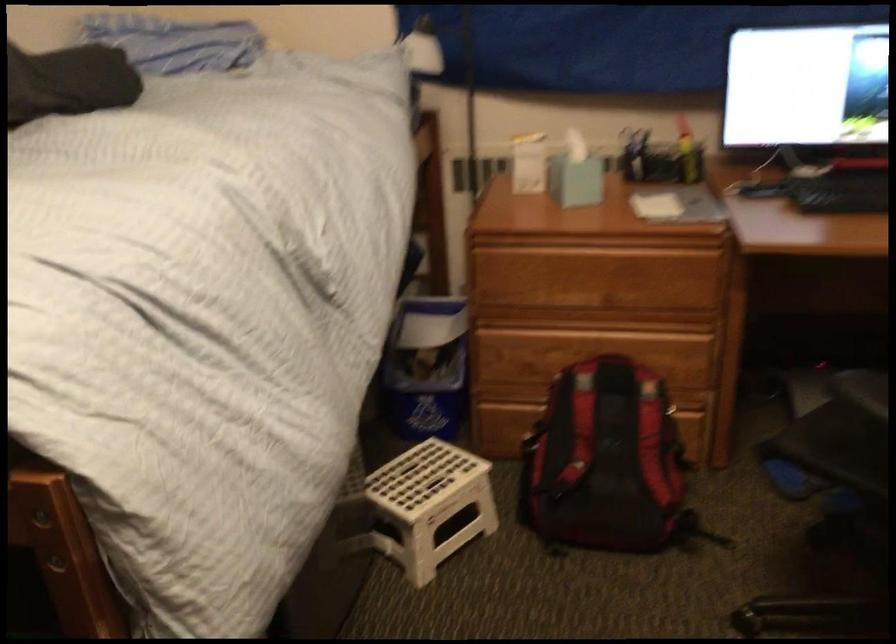
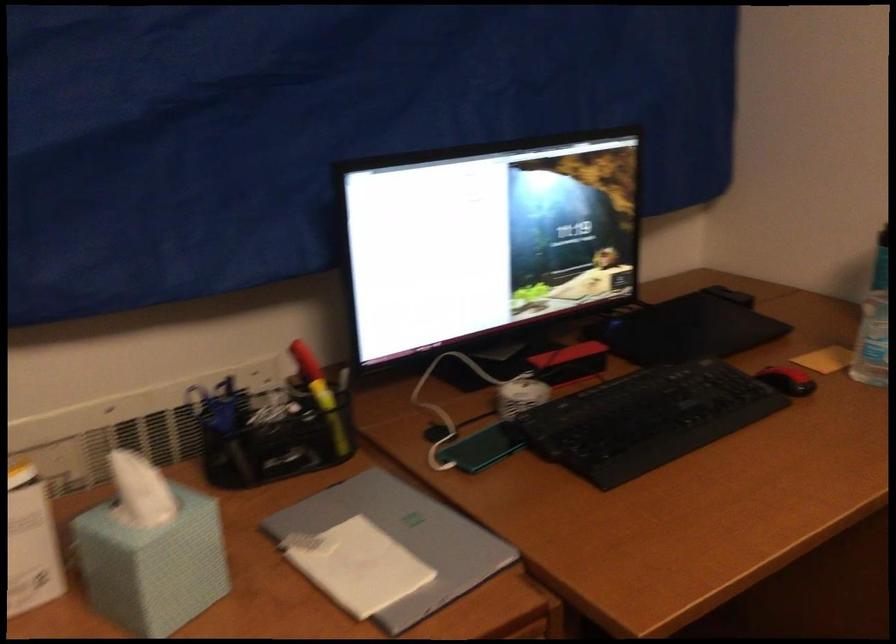
In the second image, find the point that corresponds to (x=685, y=145) in the first image.

(321, 395)